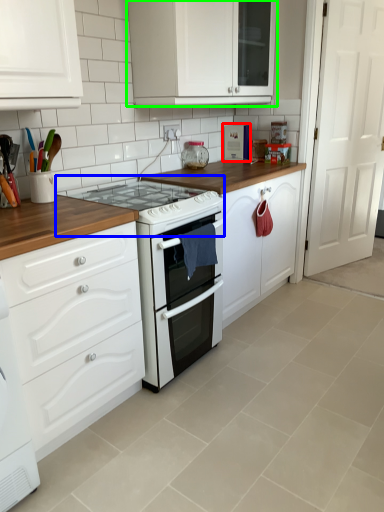
Question: Based on their relative distances, which object is farther from appliance (highlighted by a red box)? Choose from gas stove (highlighted by a blue box) and cabinetry (highlighted by a green box).

Choices:
 (A) gas stove
 (B) cabinetry

Answer: (A)